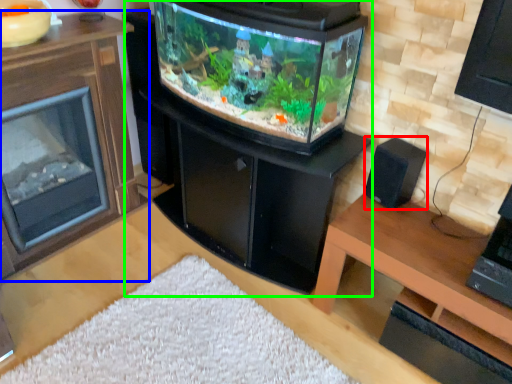
Question: Estimate the real-world distances between objects in this image. Which object is closer to speaker (highlighted by a red box), furniture (highlighted by a blue box) or fireplace (highlighted by a green box)?

Choices:
 (A) furniture
 (B) fireplace

Answer: (B)